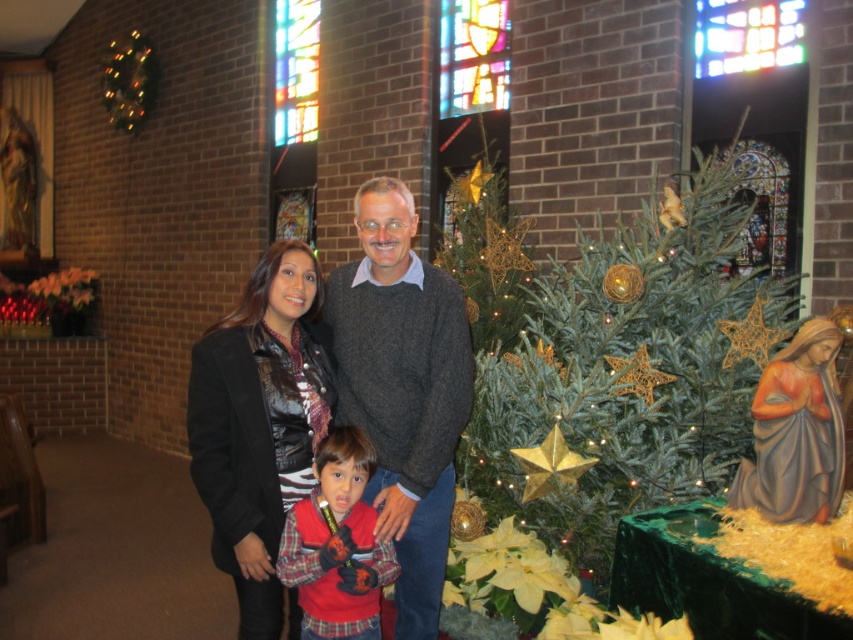
You are helping to organize a Christmas event and need to place a new decoration that requires a surface larger than the black leather jacket at center. Can the matte gray statue at right provide enough space?

The black leather jacket at center is bigger than the matte gray statue at right, so the statue does not have enough space for the decoration requiring a larger surface.

You are an interior designer assessing the clothing items in the scene. The dark gray sweater at center and the red fleece jacket at center are both placed on a rack. Which clothing item is taller?

The dark gray sweater at center is taller than the red fleece jacket at center.

You are a photographer taking a picture of the family in the church. You notice two items at the center of the image. Which one is positioned higher up, the dark gray sweater at center or the red fleece jacket at center?

The dark gray sweater at center is located above the red fleece jacket at center, so it is positioned higher up.